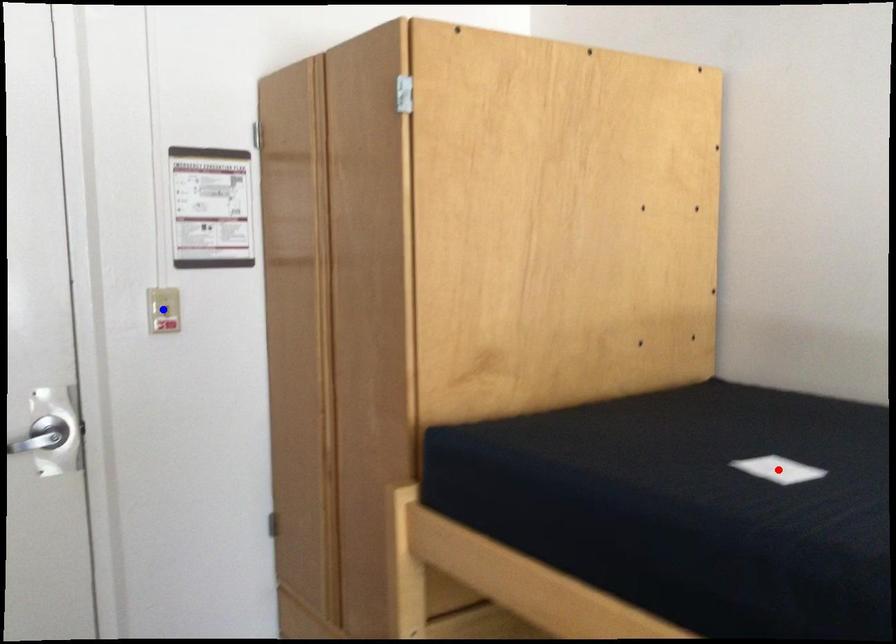
Question: Two points are marked on the image. Which point is closer to the camera?

Choices:
 (A) Blue point is closer.
 (B) Red point is closer.

Answer: (B)